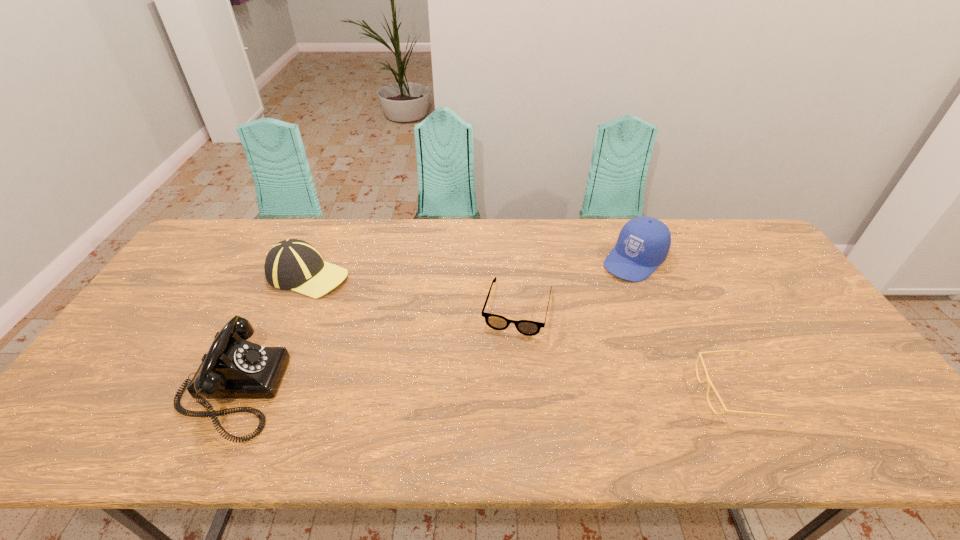
You are a GUI agent. You are given a task and a screenshot of the screen. Output one action in this format:
    pyautogui.click(x=<x>, y=<y>)
    Task: Click on the baseball cap located at the far edge
    This screenshot has height=540, width=960.
    Given the screenshot: What is the action you would take?
    pyautogui.click(x=292, y=264)

The height and width of the screenshot is (540, 960). Identify the location of telephone positioned at the near edge. (233, 367).

At what (x,y) coordinates should I click in order to perform the action: click on spectacles that is at the near edge. Please return your answer as a coordinate pair (x, y). The image size is (960, 540). Looking at the image, I should click on (707, 379).

Locate an element on the screen. This screenshot has width=960, height=540. vacant space at the far edge of the desktop is located at coordinates (327, 258).

At what (x,y) coordinates should I click in order to perform the action: click on vacant space at the near edge of the desktop. Please return your answer as a coordinate pair (x, y). This screenshot has width=960, height=540. Looking at the image, I should click on (579, 384).

Image resolution: width=960 pixels, height=540 pixels. Find the location of `free space at the left edge`. free space at the left edge is located at coordinates (173, 320).

The height and width of the screenshot is (540, 960). In the image, there is a desktop. Identify the location of vacant space at the right edge. (740, 267).

The height and width of the screenshot is (540, 960). I want to click on free location at the far right corner of the desktop, so click(724, 239).

Locate an element on the screen. The height and width of the screenshot is (540, 960). vacant region at the near right corner of the desktop is located at coordinates (852, 403).

This screenshot has height=540, width=960. Find the location of `free spot between the third shortest object and the nearer spectacles`. free spot between the third shortest object and the nearer spectacles is located at coordinates (520, 334).